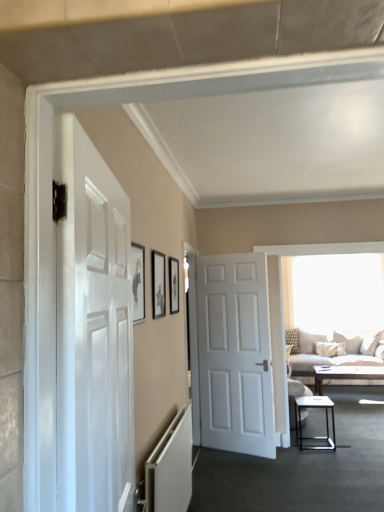
Question: Is light brown wooden coffee table at center positioned beyond the bounds of matte black picture frame at upper center, marked as the first picture frame in a right-to-left arrangement?

Choices:
 (A) no
 (B) yes

Answer: (B)

Question: From a real-world perspective, is light brown wooden coffee table at center on matte black picture frame at upper center, positioned as the 1th picture frame in back-to-front order?

Choices:
 (A) no
 (B) yes

Answer: (A)

Question: Considering the relative positions of light brown wooden coffee table at center and matte black picture frame at upper center, positioned as the 1th picture frame in back-to-front order, in the image provided, is light brown wooden coffee table at center to the right of matte black picture frame at upper center, positioned as the 1th picture frame in back-to-front order, from the viewer's perspective?

Choices:
 (A) yes
 (B) no

Answer: (A)

Question: Is light brown wooden coffee table at center behind matte black picture frame at upper center, the third picture frame from the left?

Choices:
 (A) no
 (B) yes

Answer: (B)

Question: Considering the relative sizes of light brown wooden coffee table at center and matte black picture frame at upper center, marked as the first picture frame in a right-to-left arrangement, in the image provided, is light brown wooden coffee table at center bigger than matte black picture frame at upper center, marked as the first picture frame in a right-to-left arrangement,?

Choices:
 (A) yes
 (B) no

Answer: (A)

Question: Is point (332, 414) closer or farther from the camera than point (304, 301)?

Choices:
 (A) farther
 (B) closer

Answer: (B)

Question: In terms of height, does black metal table at lower right look taller or shorter compared to transparent glass window at upper center?

Choices:
 (A) short
 (B) tall

Answer: (A)

Question: Based on their sizes in the image, would you say black metal table at lower right is bigger or smaller than transparent glass window at upper center?

Choices:
 (A) big
 (B) small

Answer: (B)

Question: Looking at their shapes, would you say black metal table at lower right is wider or thinner than transparent glass window at upper center?

Choices:
 (A) thin
 (B) wide

Answer: (B)

Question: Is point (147, 497) closer or farther from the camera than point (329, 401)?

Choices:
 (A) farther
 (B) closer

Answer: (B)

Question: In the image, is white matte radiator at lower left positioned in front of or behind black metal table at lower right?

Choices:
 (A) behind
 (B) front

Answer: (B)

Question: Considering the positions of white matte radiator at lower left and black metal table at lower right in the image, is white matte radiator at lower left wider or thinner than black metal table at lower right?

Choices:
 (A) wide
 (B) thin

Answer: (B)

Question: Is white matte radiator at lower left situated inside black metal table at lower right or outside?

Choices:
 (A) outside
 (B) inside

Answer: (A)

Question: From a real-world perspective, relative to transparent glass window at upper center, is beige fabric couch at right vertically above or below?

Choices:
 (A) above
 (B) below

Answer: (B)

Question: Would you say beige fabric couch at right is inside or outside transparent glass window at upper center?

Choices:
 (A) outside
 (B) inside

Answer: (A)